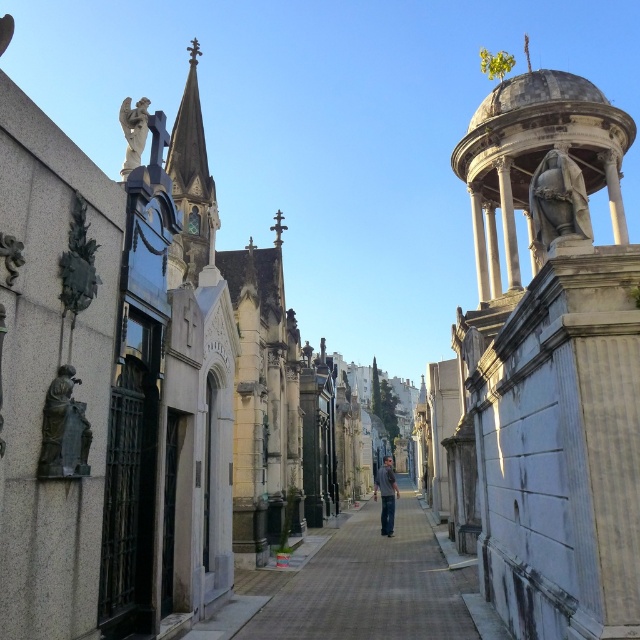
Who is shorter, white marble statue at upper center or bronze statue at left?

bronze statue at left is shorter.

Based on the photo, who is more forward, (476, 388) or (76, 444)?

Point (76, 444)

Is point (477, 355) more distant than point (64, 381)?

Yes, it is.

Locate an element on the screen. The image size is (640, 640). white marble statue at upper center is located at coordinates (548, 365).

Can you confirm if white marble statue at upper center is positioned to the right of white marble angel at upper left?

Yes, white marble statue at upper center is to the right of white marble angel at upper left.

Is white marble statue at upper center positioned before white marble angel at upper left?

Yes, it is.

Is point (545, 349) positioned behind point (128, 134)?

No, (545, 349) is in front of (128, 134).

Where is `white marble statue at upper center`? white marble statue at upper center is located at coordinates (548, 365).

This screenshot has height=640, width=640. What are the coordinates of `white marble statue at upper center` in the screenshot? It's located at coord(548,365).

At what (x,y) coordinates should I click in order to perform the action: click on white marble statue at upper center. Please return your answer as a coordinate pair (x, y). Looking at the image, I should click on (548, 365).

Find the location of a particular element. The height and width of the screenshot is (640, 640). white marble statue at upper center is located at coordinates (548, 365).